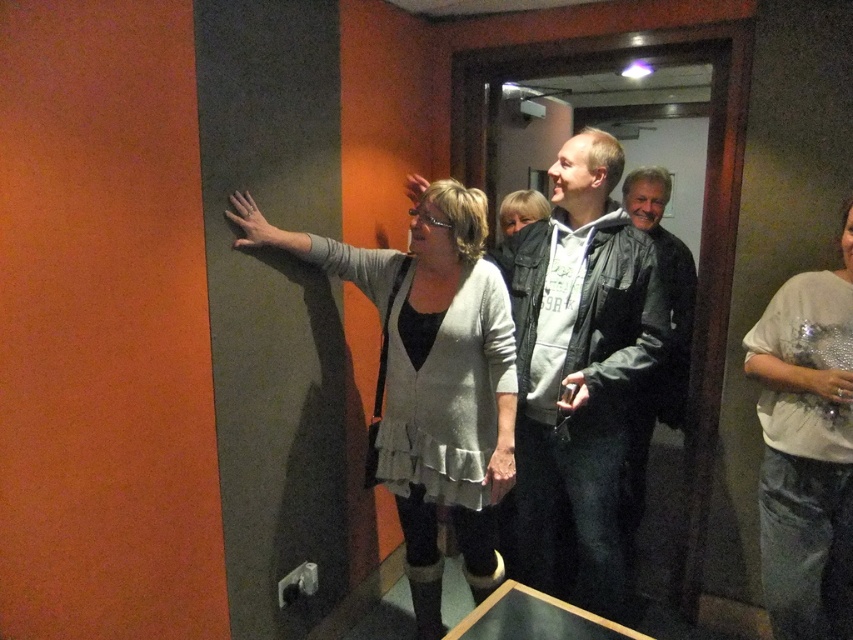
Question: Estimate the real-world distances between objects in this image. Which object is farther from the sparkly silver top at right?

Choices:
 (A) gray hoodie at center
 (B) light gray textured sweater at center

Answer: (B)

Question: Which point is closer to the camera?

Choices:
 (A) light gray textured sweater at center
 (B) gray hoodie at center

Answer: (A)

Question: Is gray hoodie at center bigger than sparkly silver top at right?

Choices:
 (A) yes
 (B) no

Answer: (A)

Question: Which of the following is the closest to the observer?

Choices:
 (A) (418, 253)
 (B) (809, 380)
 (C) (509, 531)

Answer: (B)

Question: From the image, what is the correct spatial relationship of light gray textured sweater at center in relation to sparkly silver top at right?

Choices:
 (A) below
 (B) above

Answer: (B)

Question: Does gray hoodie at center have a lesser width compared to sparkly silver top at right?

Choices:
 (A) yes
 (B) no

Answer: (B)